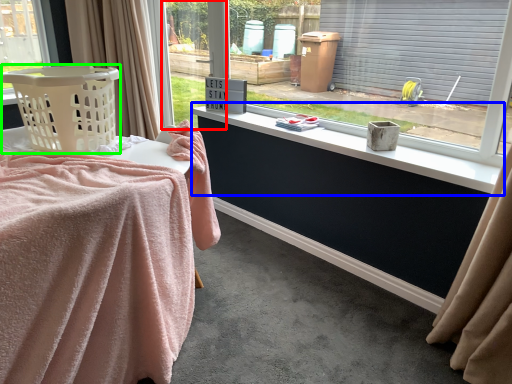
Question: Which is nearer to the window frame (highlighted by a red box)? window sill (highlighted by a blue box) or basket (highlighted by a green box).

Choices:
 (A) window sill
 (B) basket

Answer: (A)